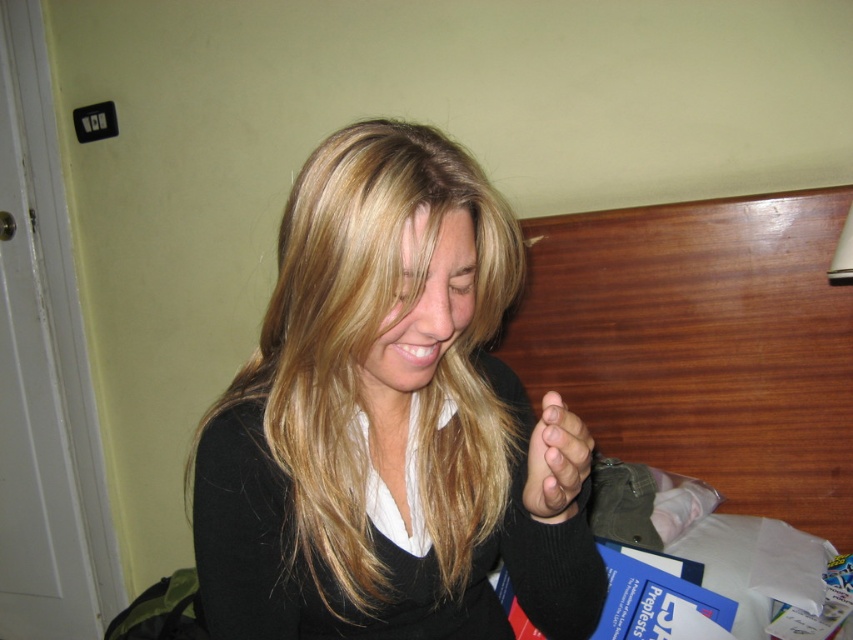
Question: Which point appears farthest from the camera in this image?

Choices:
 (A) 554,468
 (B) 496,385

Answer: (B)

Question: Which of the following is the farthest from the observer?

Choices:
 (A) (569, 442)
 (B) (236, 612)

Answer: (B)

Question: From the image, what is the correct spatial relationship of smooth black sweater at center in relation to smooth skin hand at center?

Choices:
 (A) below
 (B) above

Answer: (B)

Question: Does smooth black sweater at center lie behind smooth skin hand at center?

Choices:
 (A) no
 (B) yes

Answer: (B)

Question: Among these points, which one is farthest from the camera?

Choices:
 (A) (566, 442)
 (B) (376, 294)

Answer: (B)

Question: Does smooth black sweater at center appear over smooth skin hand at center?

Choices:
 (A) yes
 (B) no

Answer: (A)